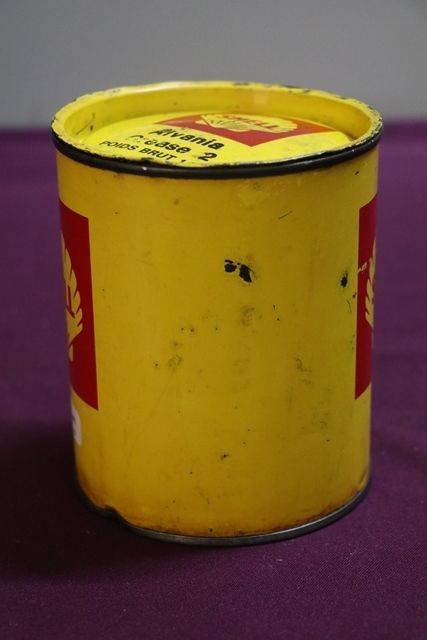
The height and width of the screenshot is (640, 427). I want to click on lid of canister, so click(x=292, y=146).